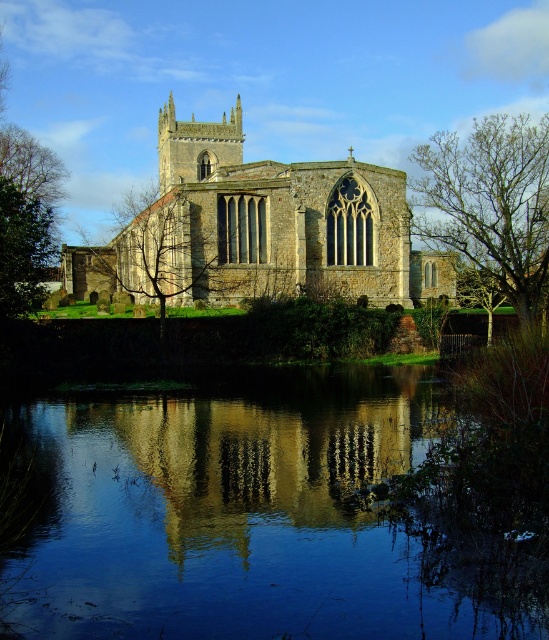
You are standing in front of the historic stone church and want to place a small decorative statue exactly at point (x=251, y=516). Since the church has a reflective body of water in front of it, will the statue be placed on the water or on the ground?

The point (x=251, y=516) is on transparent glass water at center, so the statue will be placed on the water.

You are a visitor standing in front of the historic stone church. You notice the transparent glass water at center and the green leafy tree at center. Which object is closer to the ground?

The transparent glass water at center is shorter than the green leafy tree at center, so the transparent glass water at center is closer to the ground.

You are standing in front of the historic stone church and notice the transparent glass water at center and the green leafy tree at center. Which object is closer to you?

The transparent glass water at center is closer to you since it is in front of the green leafy tree at center.